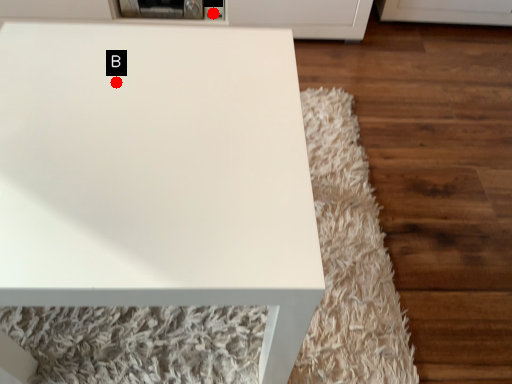
Question: Two points are circled on the image, labeled by A and B beside each circle. Among these points, which one is farthest from the camera?

Choices:
 (A) A is further
 (B) B is further

Answer: (A)